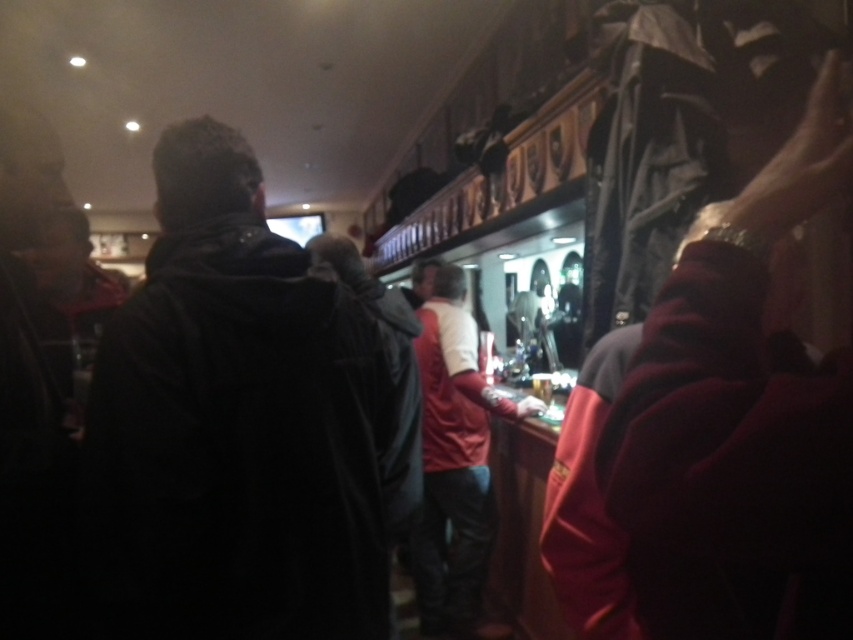
From the picture: You are a bartender preparing to place two items on the counter. The dark fabric jacket at center is currently on the counter, and the dark red sweater at right is also on the counter. Which item requires more space horizontally to accommodate?

The dark fabric jacket at center requires more horizontal space because its width is larger than the dark red sweater at right.

You are at a bar and want to order a drink. You see a dark red sweater at right and a red leather jacket at center. Which item is closer to the bar counter?

The red leather jacket at center is closer to the bar counter because the dark red sweater at right is to the right of it, meaning the jacket is positioned between the sweater and the counter.

Looking at this image, you are a bartender at the bar counter. You need to clean the area between the dark fabric jacket at center and the red leather jacket at center. Which jacket takes up more space and requires more cleaning around it?

The red leather jacket at center occupies more space than the dark fabric jacket at center, so it requires more cleaning around it.